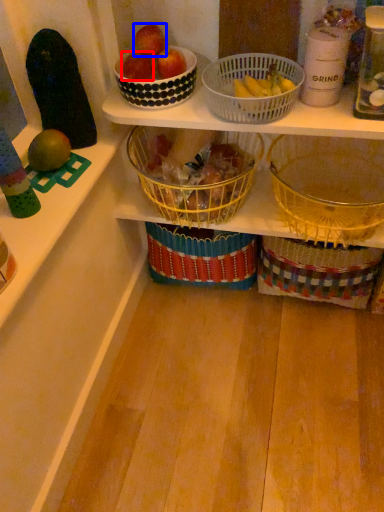
Question: Which of the following is the farthest to the observer, apple (highlighted by a red box) or apple (highlighted by a blue box)?

Choices:
 (A) apple
 (B) apple

Answer: (A)